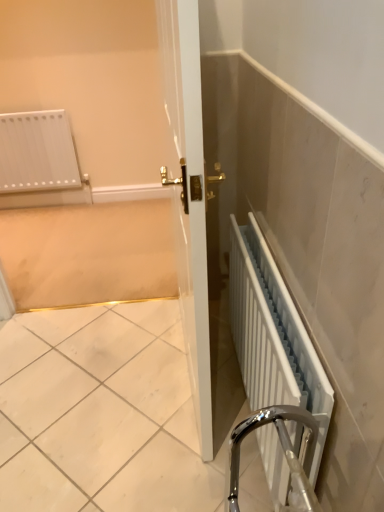
This screenshot has height=512, width=384. What do you see at coordinates (275, 377) in the screenshot?
I see `white metallic radiator at lower right` at bounding box center [275, 377].

Find the location of a particular element. This screenshot has height=512, width=384. white metallic radiator at lower right is located at coordinates (275, 377).

What is the approximate height of white metallic radiator at lower right?

white metallic radiator at lower right is 65.04 centimeters in height.

In order to face white glossy radiator at upper left, should I rotate leftwards or rightwards?

A 16.584 degree turn to the left will do.

This screenshot has height=512, width=384. Identify the location of white glossy radiator at upper left. (119, 154).

Describe the element at coordinates (119, 154) in the screenshot. I see `white glossy radiator at upper left` at that location.

Locate an element on the screen. The image size is (384, 512). white metallic radiator at lower right is located at coordinates pyautogui.click(x=275, y=377).

Is white metallic radiator at lower right to the left or to the right of white glossy radiator at upper left in the image?

white metallic radiator at lower right is to the right of white glossy radiator at upper left.

Is white metallic radiator at lower right positioned in front of white glossy radiator at upper left?

Yes, white metallic radiator at lower right is closer to the viewer.

Does point (271, 474) come behind point (139, 22)?

No, it is in front of (139, 22).

From the image's perspective, is white metallic radiator at lower right positioned above or below white glossy radiator at upper left?

From the image's perspective, white metallic radiator at lower right appears below white glossy radiator at upper left.

From the picture: From a real-world perspective, does white metallic radiator at lower right stand above white glossy radiator at upper left?

No, from a real-world perspective, white metallic radiator at lower right is not above white glossy radiator at upper left.

Which object is wider, white metallic radiator at lower right or white glossy radiator at upper left?

white glossy radiator at upper left is wider.

Who is taller, white metallic radiator at lower right or white glossy radiator at upper left?

white glossy radiator at upper left is taller.

Is white metallic radiator at lower right bigger or smaller than white glossy radiator at upper left?

Clearly, white metallic radiator at lower right is smaller in size than white glossy radiator at upper left.

Is white metallic radiator at lower right inside or outside of white glossy radiator at upper left?

white metallic radiator at lower right is not inside white glossy radiator at upper left, it's outside.

Is white metallic radiator at lower right positioned far away from white glossy radiator at upper left?

That's right, there is a large distance between white metallic radiator at lower right and white glossy radiator at upper left.

Is white metallic radiator at lower right positioned with its back to white glossy radiator at upper left?

white metallic radiator at lower right is not turned away from white glossy radiator at upper left.

Locate an element on the screen. The height and width of the screenshot is (512, 384). radiator below the white glossy radiator at upper left (from a real-world perspective) is located at coordinates (275, 377).

Would you say white glossy radiator at upper left is to the left or to the right of white metallic radiator at lower right in the picture?

In the image, white glossy radiator at upper left appears on the left side of white metallic radiator at lower right.

Which object is more forward, white glossy radiator at upper left or white metallic radiator at lower right?

white metallic radiator at lower right is closer to the camera.

Does point (129, 288) appear closer or farther from the camera than point (309, 475)?

Point (129, 288).

From the image's perspective, is white glossy radiator at upper left over white metallic radiator at lower right?

Yes, from the image's perspective, white glossy radiator at upper left is over white metallic radiator at lower right.

From a real-world perspective, relative to white metallic radiator at lower right, is white glossy radiator at upper left vertically above or below?

white glossy radiator at upper left is above white metallic radiator at lower right.

Between white glossy radiator at upper left and white metallic radiator at lower right, which one has smaller width?

With smaller width is white metallic radiator at lower right.

Who is shorter, white glossy radiator at upper left or white metallic radiator at lower right?

With less height is white metallic radiator at lower right.

Who is bigger, white glossy radiator at upper left or white metallic radiator at lower right?

white glossy radiator at upper left.

Can white metallic radiator at lower right be found inside white glossy radiator at upper left?

No, white glossy radiator at upper left does not contain white metallic radiator at lower right.

Is white glossy radiator at upper left next to white metallic radiator at lower right?

There is a gap between white glossy radiator at upper left and white metallic radiator at lower right.

Could you tell me if white glossy radiator at upper left is facing white metallic radiator at lower right?

Yes, white glossy radiator at upper left is oriented towards white metallic radiator at lower right.

Can you tell me how much white glossy radiator at upper left and white metallic radiator at lower right differ in facing direction?

90.9 degrees separate the facing orientations of white glossy radiator at upper left and white metallic radiator at lower right.

Image resolution: width=384 pixels, height=512 pixels. What are the coordinates of `radiator below the white glossy radiator at upper left (from a real-world perspective)` in the screenshot? It's located at (275, 377).

What are the coordinates of `screen door that appears behind the white metallic radiator at lower right` in the screenshot? It's located at (119, 154).

In the image, there is a white metallic radiator at lower right. What are the coordinates of `screen door above it (from the image's perspective)` in the screenshot? It's located at (119, 154).